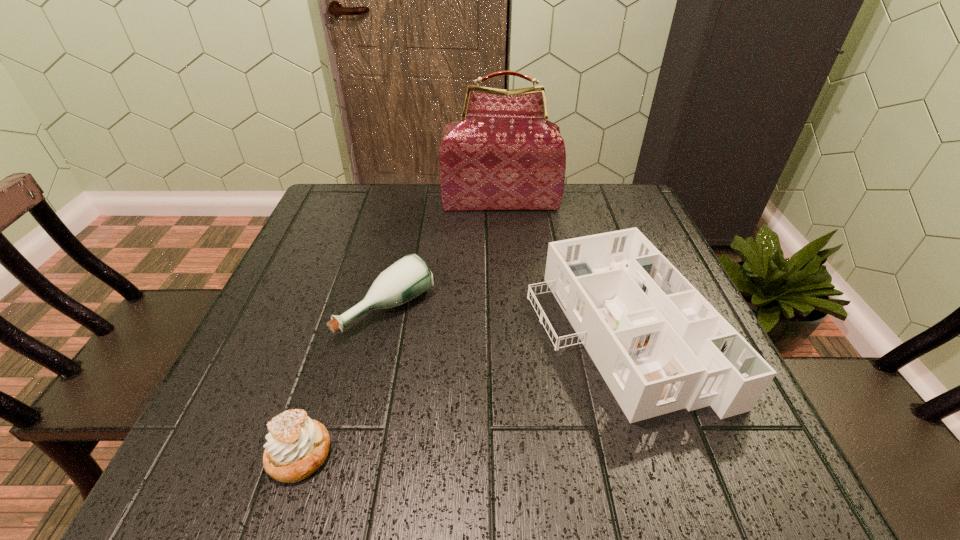
Locate an element on the screen. the tallest object is located at coordinates (503, 154).

I want to click on handbag, so click(503, 154).

Identify the location of dollhouse. This screenshot has width=960, height=540. (660, 346).

You are a GUI agent. You are given a task and a screenshot of the screen. Output one action in this format:
    pyautogui.click(x=<x>, y=<y>)
    Task: Click on the bottle
    
    Given the screenshot: What is the action you would take?
    pyautogui.click(x=407, y=278)

This screenshot has width=960, height=540. Identify the location of the nearest object. (297, 446).

The height and width of the screenshot is (540, 960). In order to click on vacant position located 0.240m on the front-facing side of the tallest object in this screenshot , I will do `click(505, 269)`.

At what (x,y) coordinates should I click in order to perform the action: click on vacant space situated on the back of the dollhouse. Please return your answer as a coordinate pair (x, y). The image size is (960, 540). Looking at the image, I should click on (581, 210).

The height and width of the screenshot is (540, 960). Identify the location of vacant space located 0.250m on the right of the bottle. (555, 309).

Identify the location of free space located 0.080m on the right of the pastry. (384, 454).

Locate an element on the screen. The image size is (960, 540). object at the far edge is located at coordinates (503, 154).